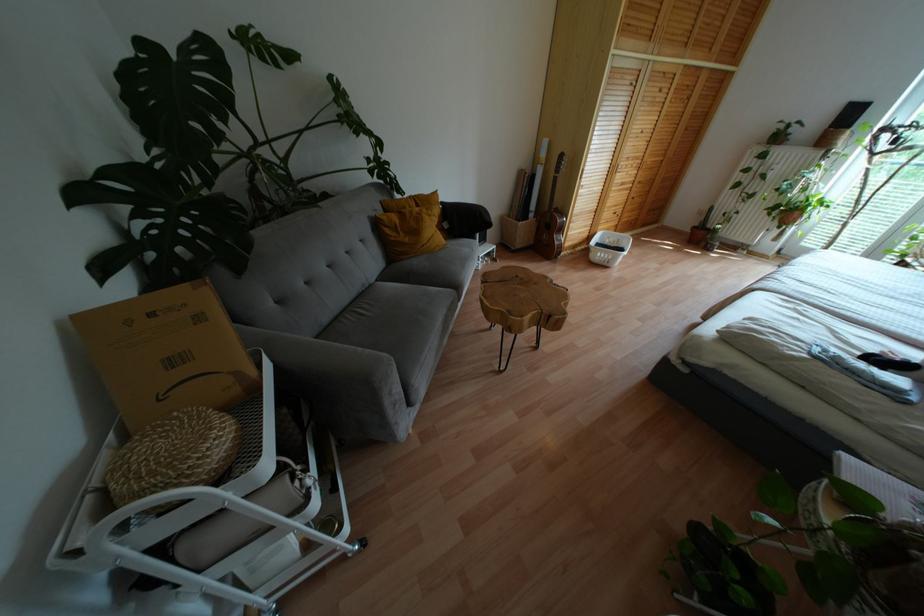
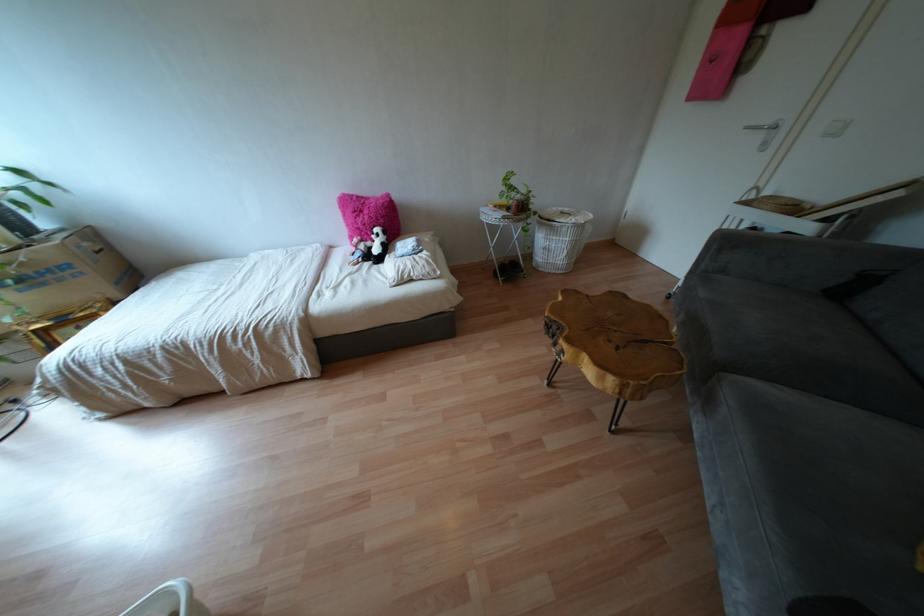
Find the pixel in the second image that matches pixel 833 331 in the first image.

(349, 274)